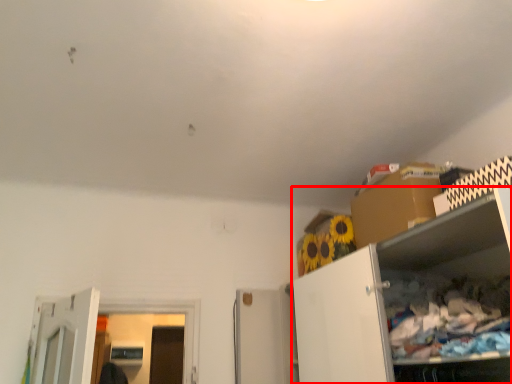
Question: From the image's perspective, considering the relative positions of cabinetry (annotated by the red box) and cardboard box in the image provided, where is cabinetry (annotated by the red box) located with respect to the staircase?

Choices:
 (A) below
 (B) above

Answer: (A)